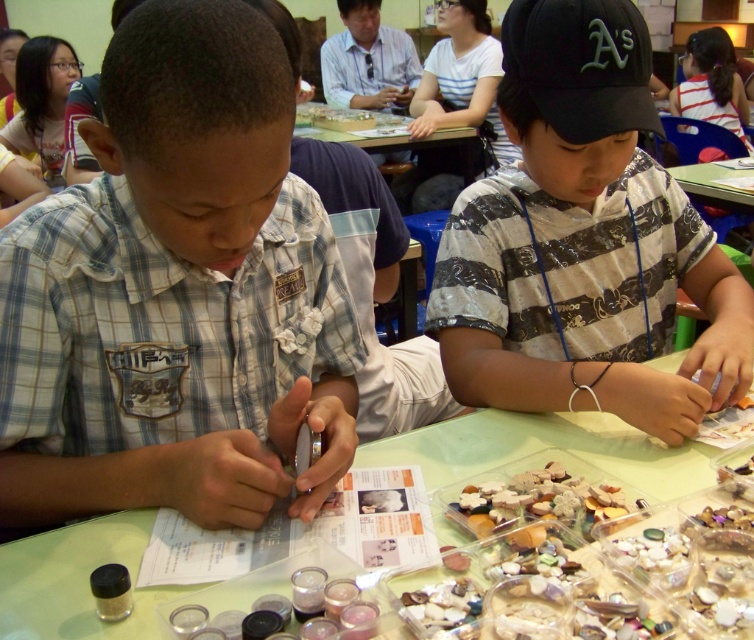
Does point (28, 262) come closer to viewer compared to point (513, 387)?

Yes.

Is point (235, 484) positioned after point (615, 40)?

No, it is not.

At what (x,y) coordinates should I click in order to perform the action: click on plaid shirt at left. Please return your answer as a coordinate pair (x, y). Image resolution: width=754 pixels, height=640 pixels. Looking at the image, I should click on (176, 294).

Who is lower down, black striped shirt at center or clear plastic table at center?

clear plastic table at center is below.

Which is above, black striped shirt at center or clear plastic table at center?

black striped shirt at center is above.

Is point (598, 93) closer to viewer compared to point (621, 483)?

No, (598, 93) is further to viewer.

The width and height of the screenshot is (754, 640). I want to click on black striped shirt at center, so [x=584, y=241].

Between plaid shirt at left and clear plastic table at center, which one has more height?

Standing taller between the two is plaid shirt at left.

Between plaid shirt at left and clear plastic table at center, which one has less height?

clear plastic table at center is shorter.

This screenshot has height=640, width=754. I want to click on plaid shirt at left, so click(176, 294).